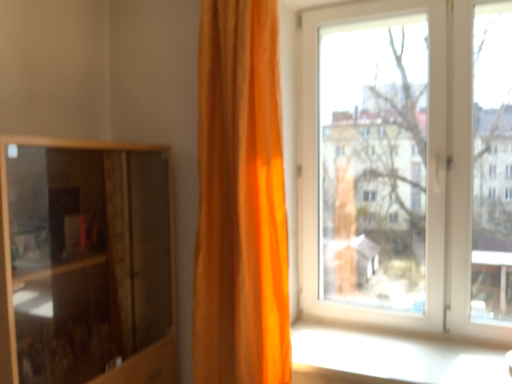
At what (x,y) coordinates should I click in order to perform the action: click on free spot above white glossy window sill at lower right (from a real-world perspective). Please return your answer as a coordinate pair (x, y). The image size is (512, 384). Looking at the image, I should click on (391, 350).